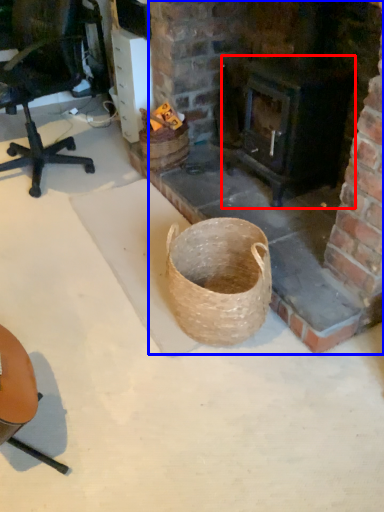
Question: Which of the following is the closest to the observer, stove (highlighted by a red box) or fireplace (highlighted by a blue box)?

Choices:
 (A) stove
 (B) fireplace

Answer: (B)